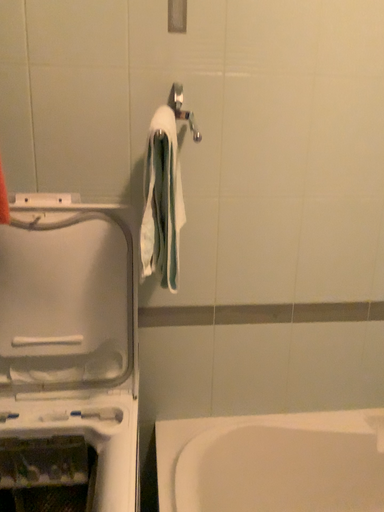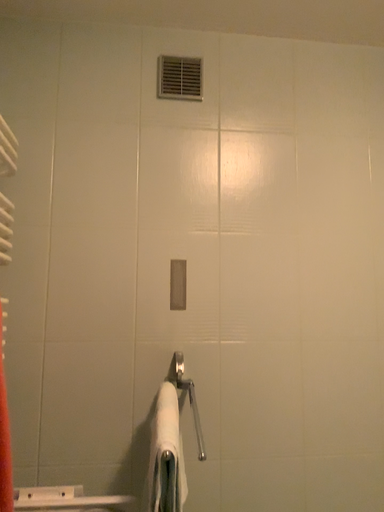
Question: Which way did the camera rotate in the video?

Choices:
 (A) rotated downward
 (B) rotated upward

Answer: (B)